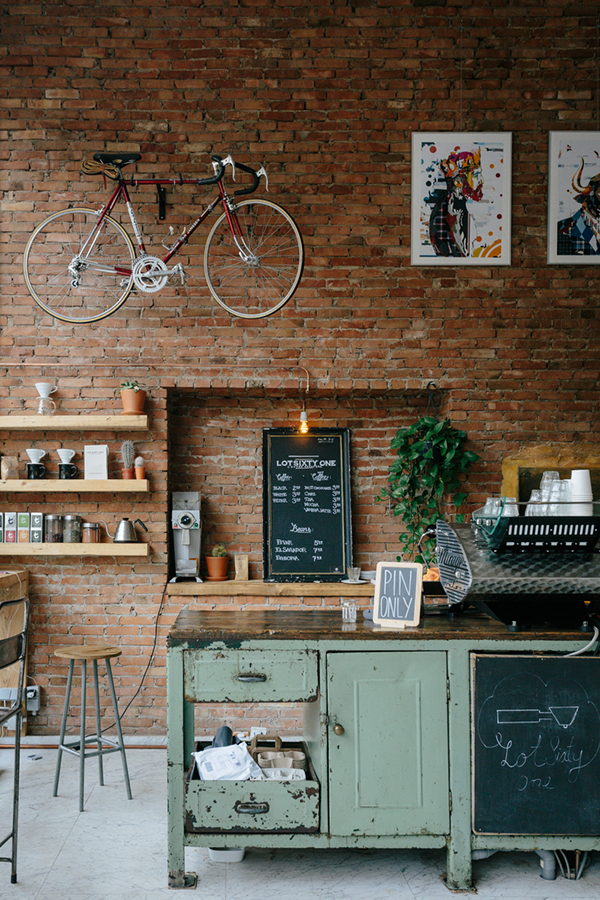
Identify the location of blackboards. The width and height of the screenshot is (600, 900). (306, 522), (548, 743), (394, 587).